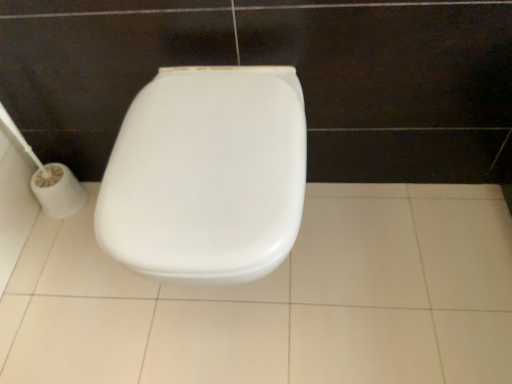
Locate an element on the screen. The image size is (512, 384). vacant space to the right of white plastic toilet at center is located at coordinates (383, 263).